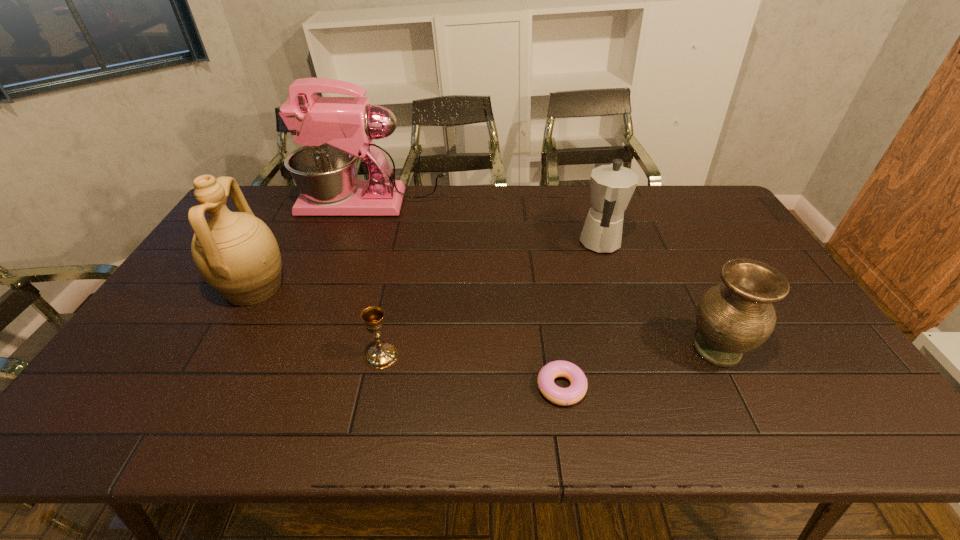
This screenshot has width=960, height=540. Find the location of `vacant region that satisfies the following two spatial constraints: 1. on the back side of the doughnut; 2. on the left side of the fifth object from left to right`. vacant region that satisfies the following two spatial constraints: 1. on the back side of the doughnut; 2. on the left side of the fifth object from left to right is located at coordinates (539, 244).

Where is `vacant point that satisfies the following two spatial constraints: 1. on the face of the fifth object from left to right; 2. on the left side of the mixer`? vacant point that satisfies the following two spatial constraints: 1. on the face of the fifth object from left to right; 2. on the left side of the mixer is located at coordinates (360, 244).

I want to click on free location that satisfies the following two spatial constraints: 1. on the face of the farthest object; 2. on the back side of the vase, so click(x=325, y=350).

You are a GUI agent. You are given a task and a screenshot of the screen. Output one action in this format:
    pyautogui.click(x=<x>, y=<y>)
    Task: Click on the vacant area that satisfies the following two spatial constraints: 1. on the face of the mixer; 2. on the back side of the doughnut
    
    Given the screenshot: What is the action you would take?
    pyautogui.click(x=313, y=387)

This screenshot has width=960, height=540. I want to click on vacant region that satisfies the following two spatial constraints: 1. on the face of the fourth tallest object; 2. on the right side of the farthest object, so click(x=325, y=350).

This screenshot has height=540, width=960. I want to click on vacant region that satisfies the following two spatial constraints: 1. on the face of the mixer; 2. on the back side of the rightmost object, so tap(325, 350).